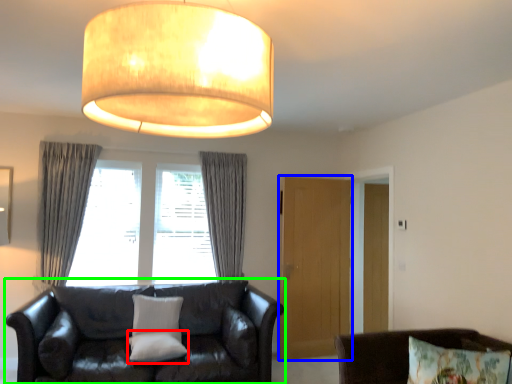
Question: Which is farther away from pillow (highlighted by a red box)? glass door (highlighted by a blue box) or studio couch (highlighted by a green box)?

Choices:
 (A) glass door
 (B) studio couch

Answer: (A)